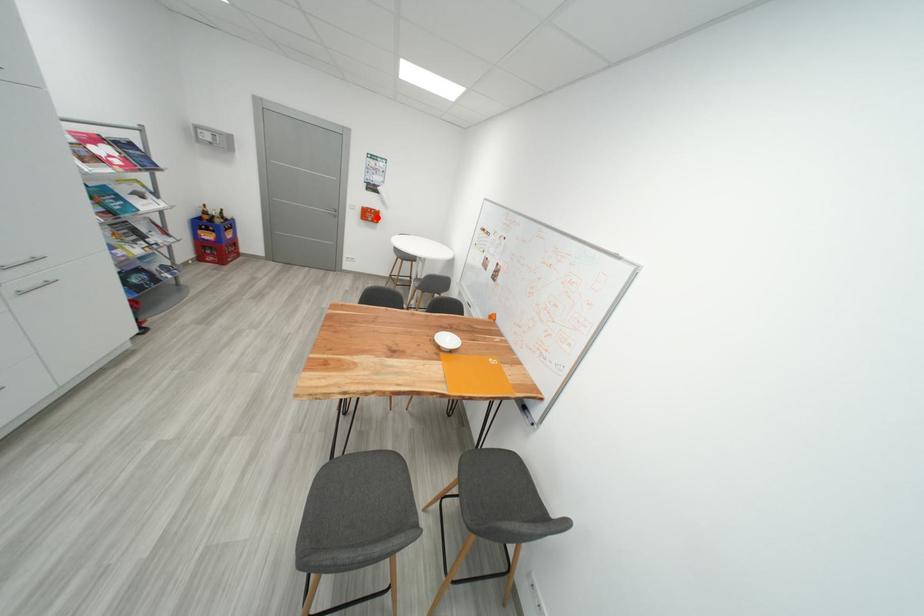
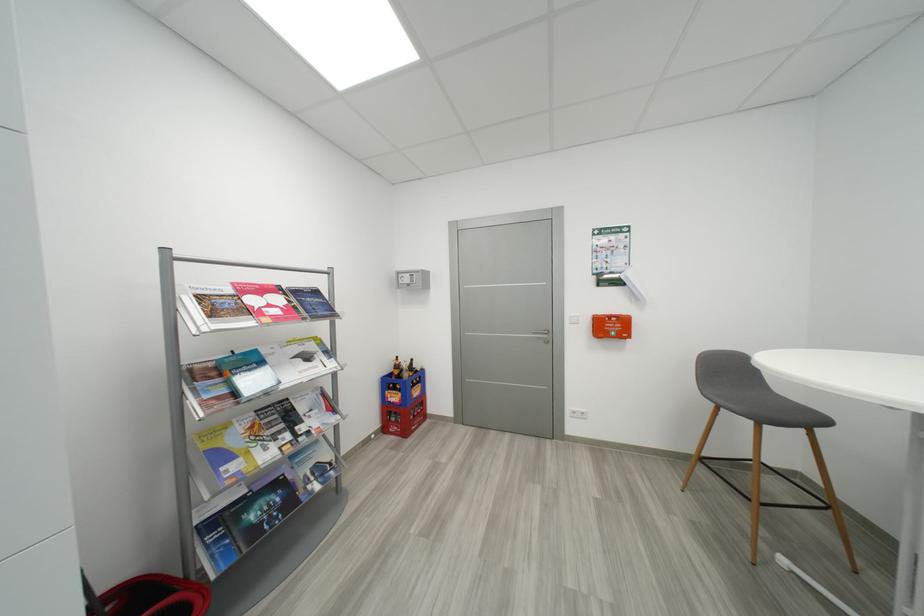
In the second image, find the point that corresponds to the highlighted location in the first image.

(617, 330)